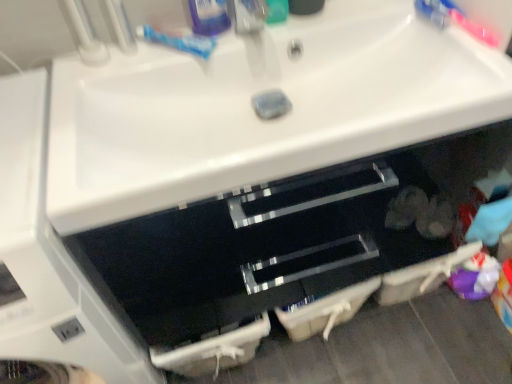
Question: Is blue matte toothpaste at upper center closer to the viewer compared to matte plastic faucet at upper center?

Choices:
 (A) yes
 (B) no

Answer: (B)

Question: Is blue matte toothpaste at upper center positioned behind matte plastic faucet at upper center?

Choices:
 (A) yes
 (B) no

Answer: (A)

Question: Are blue matte toothpaste at upper center and matte plastic faucet at upper center beside each other?

Choices:
 (A) no
 (B) yes

Answer: (A)

Question: Is blue matte toothpaste at upper center oriented towards matte plastic faucet at upper center?

Choices:
 (A) yes
 (B) no

Answer: (B)

Question: Can you confirm if blue matte toothpaste at upper center is positioned to the left of matte plastic faucet at upper center?

Choices:
 (A) yes
 (B) no

Answer: (A)

Question: From a real-world perspective, is pink plastic toothbrush at upper right above or below blue glossy toothpaste tube at upper center, marked as the second toiletry in a right-to-left arrangement?

Choices:
 (A) below
 (B) above

Answer: (A)

Question: Choose the correct answer: Is pink plastic toothbrush at upper right inside blue glossy toothpaste tube at upper center, marked as the second toiletry in a right-to-left arrangement, or outside it?

Choices:
 (A) inside
 (B) outside

Answer: (B)

Question: Is pink plastic toothbrush at upper right to the left or to the right of blue glossy toothpaste tube at upper center, the 1th toiletry when ordered from left to right, in the image?

Choices:
 (A) right
 (B) left

Answer: (A)

Question: From the image's perspective, is pink plastic toothbrush at upper right above or below blue glossy toothpaste tube at upper center, the 1th toiletry when ordered from left to right?

Choices:
 (A) above
 (B) below

Answer: (B)

Question: From the image's perspective, relative to blue glossy toothpaste tube at upper center, marked as the second toiletry in a right-to-left arrangement, is green plastic toothpaste tube at upper center, the 1th toiletry in the right-to-left sequence, above or below?

Choices:
 (A) below
 (B) above

Answer: (A)

Question: Considering the positions of green plastic toothpaste tube at upper center, the 2th toiletry viewed from the left, and blue glossy toothpaste tube at upper center, the 1th toiletry when ordered from left to right, in the image, is green plastic toothpaste tube at upper center, the 2th toiletry viewed from the left, wider or thinner than blue glossy toothpaste tube at upper center, the 1th toiletry when ordered from left to right,?

Choices:
 (A) thin
 (B) wide

Answer: (A)

Question: Considering their positions, is green plastic toothpaste tube at upper center, the 2th toiletry viewed from the left, located in front of or behind blue glossy toothpaste tube at upper center, the 1th toiletry when ordered from left to right?

Choices:
 (A) behind
 (B) front

Answer: (A)

Question: From a real-world perspective, is green plastic toothpaste tube at upper center, the 1th toiletry in the right-to-left sequence, above or below blue glossy toothpaste tube at upper center, the 1th toiletry when ordered from left to right?

Choices:
 (A) above
 (B) below

Answer: (B)

Question: In terms of size, does pink plastic toothbrush at upper right appear bigger or smaller than blue matte toothpaste at upper center?

Choices:
 (A) small
 (B) big

Answer: (A)

Question: In terms of height, does pink plastic toothbrush at upper right look taller or shorter compared to blue matte toothpaste at upper center?

Choices:
 (A) short
 (B) tall

Answer: (B)